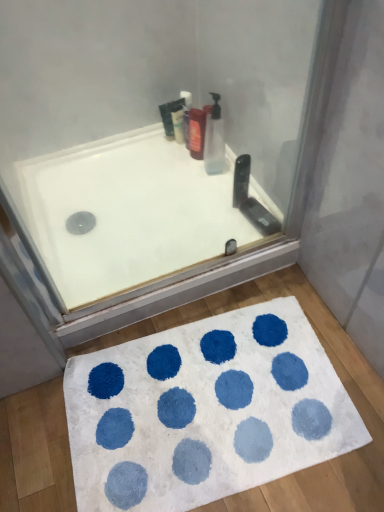
At what (x,y) coordinates should I click in order to perform the action: click on free space on the front side of shiny plastic soap dispenser at upper center. Please return your answer as a coordinate pair (x, y). The height and width of the screenshot is (512, 384). Looking at the image, I should click on (189, 176).